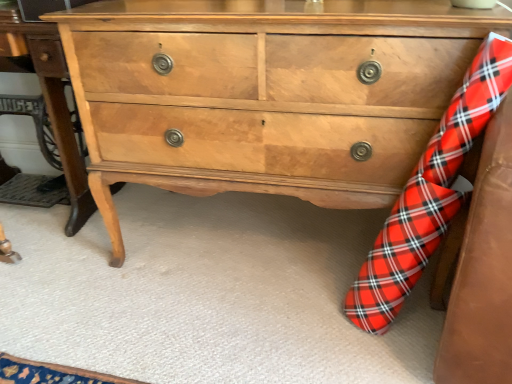
This screenshot has width=512, height=384. Find the location of `free point in front of light brown wood table at center`. free point in front of light brown wood table at center is located at coordinates (64, 284).